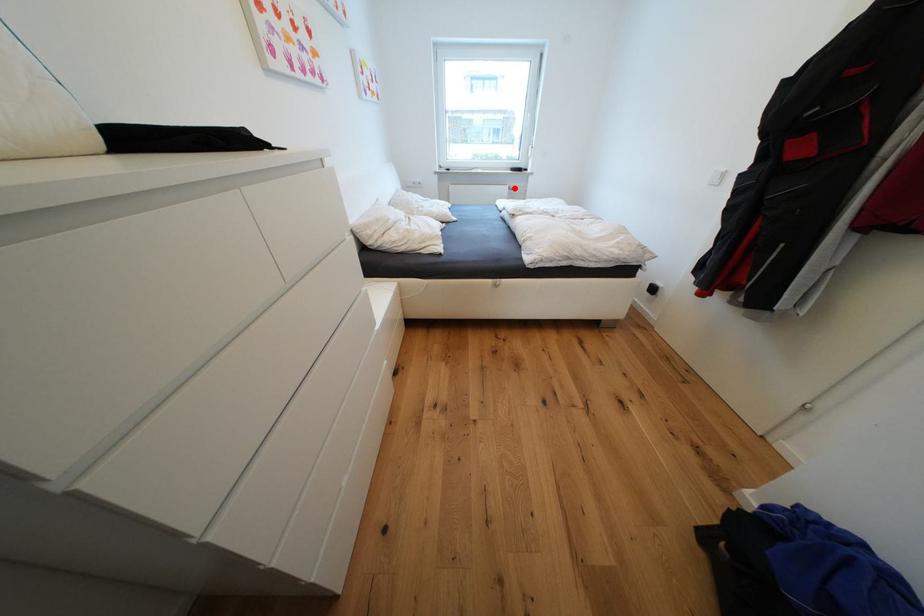
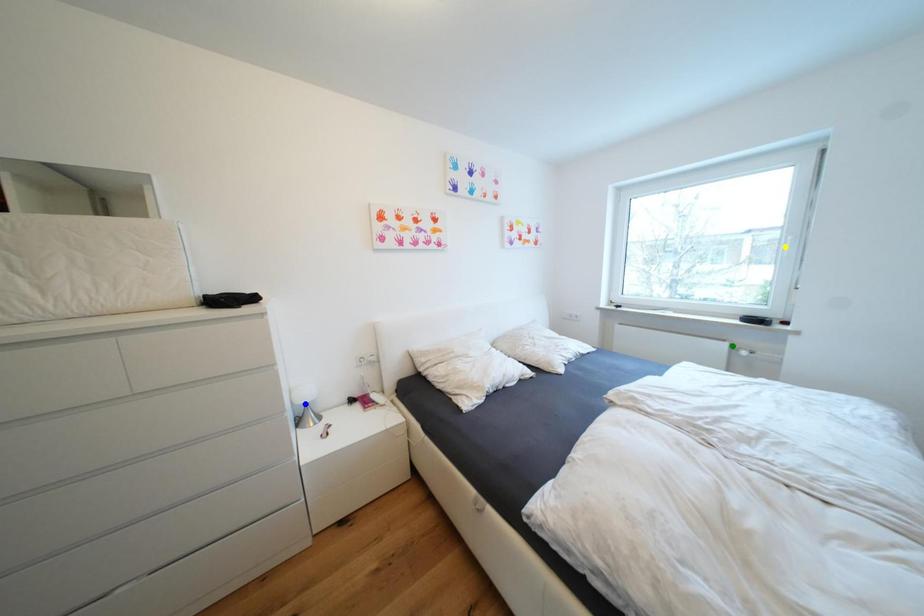
Question: I am providing you with two images of the same scene from different viewpoints. A red point is marked on the first image. You are given multiple points on the second image. Which mark in image 2 goes with the point in image 1?

Choices:
 (A) yellow point
 (B) blue point
 (C) green point

Answer: (C)